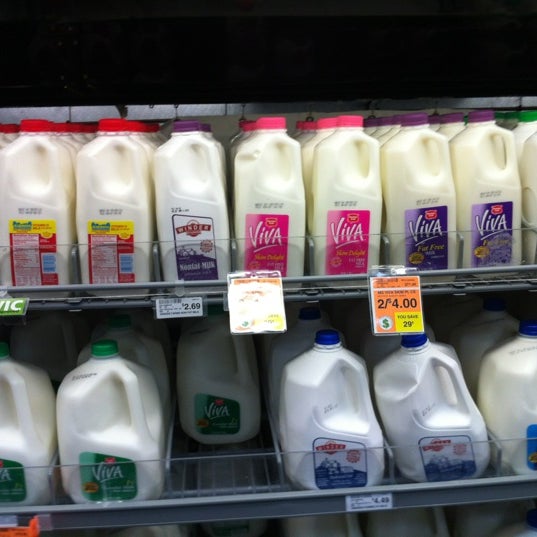
At what (x,y) coordinates should I click in order to perform the action: click on milk jug with pink lids. Please return your answer as a coordinate pair (x, y). The width and height of the screenshot is (537, 537). Looking at the image, I should click on (274, 115), (243, 122), (354, 124), (331, 124), (308, 125), (297, 125).